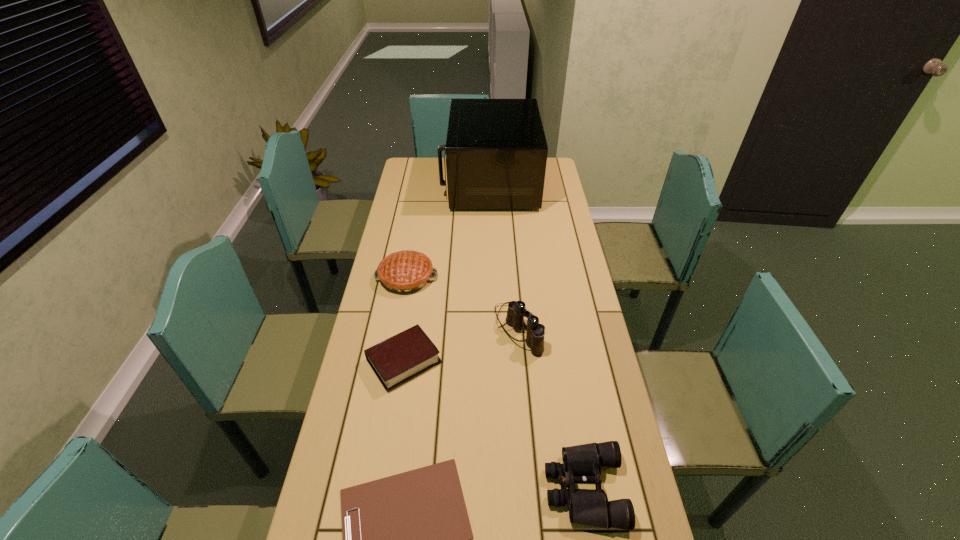
Image resolution: width=960 pixels, height=540 pixels. I want to click on Bible that is at the left edge, so click(x=403, y=356).

Image resolution: width=960 pixels, height=540 pixels. What are the coordinates of `microwave_oven located in the right edge section of the desktop` in the screenshot? It's located at (496, 151).

This screenshot has width=960, height=540. I want to click on binoculars at the right edge, so click(582, 463).

Image resolution: width=960 pixels, height=540 pixels. Identify the location of object located at the far right corner. (496, 151).

Find the location of a particular element. This screenshot has width=960, height=540. vacant region at the left edge is located at coordinates (425, 245).

This screenshot has height=540, width=960. Find the location of `vacant space at the right edge of the desktop`. vacant space at the right edge of the desktop is located at coordinates (552, 198).

Where is `free location at the far left corner of the desktop`? This screenshot has height=540, width=960. free location at the far left corner of the desktop is located at coordinates (409, 180).

Identify the location of vacant area that lies between the shorter binoculars and the farther binoculars. The image size is (960, 540). (551, 409).

This screenshot has height=540, width=960. What are the coordinates of `vacant area that lies between the taller binoculars and the nearer binoculars` in the screenshot? It's located at (551, 409).

You are a GUI agent. You are given a task and a screenshot of the screen. Output one action in this format:
    pyautogui.click(x=<x>, y=<y>)
    Task: Click on the empty space between the Bible and the shorter binoculars
    The width and height of the screenshot is (960, 540).
    Given the screenshot: What is the action you would take?
    pyautogui.click(x=494, y=424)